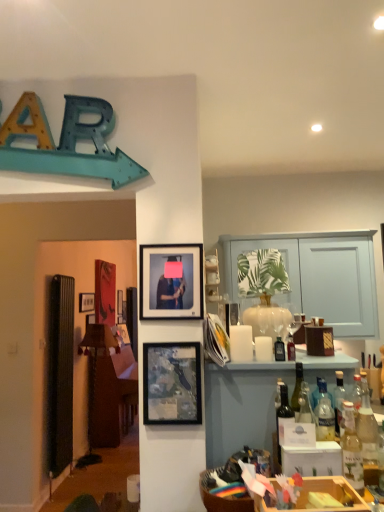
What is the approximate height of translucent glass bottle at right, the fifth bottle positioned from the right?

The height of translucent glass bottle at right, the fifth bottle positioned from the right, is 8.99 inches.

This screenshot has height=512, width=384. Describe the element at coordinates (339, 399) in the screenshot. I see `clear glass bottle at right, the fifth bottle positioned from the left` at that location.

What is the approximate width of matte glass picture frame at center, the 3th picture frame positioned from the back?

It is 1.08 inches.

Find the location of a particular element. translucent glass bottle at center-right, the 3th bottle when ordered from left to right is located at coordinates (291, 348).

Could you tell me if matte black picture frame at upper left, marked as the first picture frame in a back-to-front arrangement, is facing matte glass bottle at center, which is the second bottle from left to right?

No, matte black picture frame at upper left, marked as the first picture frame in a back-to-front arrangement, is not turned towards matte glass bottle at center, which is the second bottle from left to right.

Considering the relative sizes of matte black picture frame at upper left, the third picture frame when ordered from right to left, and matte glass bottle at center, which is counted as the fifth bottle, starting from the front, in the image provided, is matte black picture frame at upper left, the third picture frame when ordered from right to left, shorter than matte glass bottle at center, which is counted as the fifth bottle, starting from the front,?

No, matte black picture frame at upper left, the third picture frame when ordered from right to left, is not shorter than matte glass bottle at center, which is counted as the fifth bottle, starting from the front.

From a real-world perspective, is matte black picture frame at upper left, marked as the first picture frame in a back-to-front arrangement, on top of matte glass bottle at center, which appears as the fourth bottle when viewed from the right?

Correct, in the physical world, matte black picture frame at upper left, marked as the first picture frame in a back-to-front arrangement, is higher than matte glass bottle at center, which appears as the fourth bottle when viewed from the right.

Is matte black picture frame at upper left, the 3th picture frame positioned from the front, in contact with matte glass bottle at center, which is the second bottle from left to right?

No, matte black picture frame at upper left, the 3th picture frame positioned from the front, is not next to matte glass bottle at center, which is the second bottle from left to right.

Is green glass wine bottle at center wider or thinner than transparent glass vase at center?

In the image, green glass wine bottle at center appears to be more narrow than transparent glass vase at center.

Which is in front, green glass wine bottle at center or transparent glass vase at center?

green glass wine bottle at center is more forward.

At what (x,y) coordinates should I click in order to perform the action: click on wine bottle to the right of transparent glass vase at center. Please return your answer as a coordinate pair (x, y). The height and width of the screenshot is (512, 384). Looking at the image, I should click on (300, 394).

Could you tell me if green glass wine bottle at center is facing transparent glass vase at center?

No, green glass wine bottle at center is not turned towards transparent glass vase at center.

Where is `bottle that is the 3rd object located behind the wooden crate at lower right`? Image resolution: width=384 pixels, height=512 pixels. bottle that is the 3rd object located behind the wooden crate at lower right is located at coordinates (339, 399).

From a real-world perspective, is wooden crate at lower right over clear glass bottle at right, placed as the 3th bottle when sorted from front to back?

Incorrect, from a real-world perspective, wooden crate at lower right is lower than clear glass bottle at right, placed as the 3th bottle when sorted from front to back.

From the image's perspective, is wooden crate at lower right under clear glass bottle at right, the fifth bottle positioned from the left?

Correct, wooden crate at lower right appears lower than clear glass bottle at right, the fifth bottle positioned from the left, in the image.

Considering their positions, is wooden crate at lower right located in front of or behind clear glass bottle at right, placed as the 3th bottle when sorted from front to back?

Visually, wooden crate at lower right is located in front of clear glass bottle at right, placed as the 3th bottle when sorted from front to back.

Who is bigger, matte glass bottle at center, which is the second bottle from left to right, or matte black frame at upper center, the second picture frame when ordered from front to back?

With larger size is matte black frame at upper center, the second picture frame when ordered from front to back.

What's the angular difference between matte glass bottle at center, which is counted as the 1th bottle, starting from the back, and matte black frame at upper center, which is the 2th picture frame from back to front,'s facing directions?

0.258 degrees separate the facing orientations of matte glass bottle at center, which is counted as the 1th bottle, starting from the back, and matte black frame at upper center, which is the 2th picture frame from back to front.

Is matte glass bottle at center, which is the second bottle from left to right, positioned behind matte black frame at upper center, the second picture frame when ordered from front to back?

Yes, it is behind matte black frame at upper center, the second picture frame when ordered from front to back.

What's the angular difference between green glass wine bottle at center and translucent glass bottle at right, the 2th bottle in the right-to-left sequence,'s facing directions?

0.000348 degrees separate the facing orientations of green glass wine bottle at center and translucent glass bottle at right, the 2th bottle in the right-to-left sequence.

Can you confirm if green glass wine bottle at center is bigger than translucent glass bottle at right, which is the 1th bottle from front to back?

Incorrect, green glass wine bottle at center is not larger than translucent glass bottle at right, which is the 1th bottle from front to back.

Is green glass wine bottle at center oriented towards translucent glass bottle at right, which appears as the 5th bottle when viewed from the back?

No, green glass wine bottle at center does not turn towards translucent glass bottle at right, which appears as the 5th bottle when viewed from the back.

In the scene shown: Is green glass wine bottle at center directly adjacent to translucent glass bottle at right, which appears as the 5th bottle when viewed from the back?

No, green glass wine bottle at center is not touching translucent glass bottle at right, which appears as the 5th bottle when viewed from the back.

Considering their positions, is translucent glass bottle at center-right, which is the 3th bottle in right-to-left order, located in front of or behind green glass wine bottle at center?

Visually, translucent glass bottle at center-right, which is the 3th bottle in right-to-left order, is located behind green glass wine bottle at center.

From the image's perspective, is translucent glass bottle at center-right, the 3th bottle when ordered from left to right, below green glass wine bottle at center?

Incorrect, from the image's perspective, translucent glass bottle at center-right, the 3th bottle when ordered from left to right, is higher than green glass wine bottle at center.

Does translucent glass bottle at center-right, the 3th bottle when ordered from left to right, contain green glass wine bottle at center?

→ No, translucent glass bottle at center-right, the 3th bottle when ordered from left to right, does not contain green glass wine bottle at center.

Is there a large distance between translucent glass bottle at right, which is the 1th bottle from front to back, and translucent glass bottles at right?

Indeed, translucent glass bottle at right, which is the 1th bottle from front to back, is not near translucent glass bottles at right.

Is point (345, 419) farther from camera compared to point (360, 334)?

No, (345, 419) is closer to viewer.

Which object is further away from the camera, translucent glass bottle at right, which is the 1th bottle from front to back, or translucent glass bottles at right?

translucent glass bottles at right is further away from the camera.

Where is `the 1st bottle positioned above the translucent glass bottles at right (from the image's perspective)`? the 1st bottle positioned above the translucent glass bottles at right (from the image's perspective) is located at coordinates (352, 450).

From the image's perspective, starting from the matte black picture frame at upper left, marked as the first picture frame in a back-to-front arrangement, which bottle is the 1st one above? Please provide its 2D coordinates.

[(279, 349)]

The width and height of the screenshot is (384, 512). What are the coordinates of `wine bottle on the right of transparent glass vase at center` in the screenshot? It's located at pos(300,394).

Which object lies nearer to the anchor point matte glass bottle at center, which is the second bottle from left to right, wooden crate at lower right or translucent glass bottles at right?

wooden crate at lower right.

Based on their spatial positions, is matte glass bottle at center, which appears as the fourth bottle when viewed from the right, or clear glass bottle at right, the fifth bottle positioned from the left, closer to green glass wine bottle at center?

clear glass bottle at right, the fifth bottle positioned from the left, is closer to green glass wine bottle at center.

Considering their positions, is matte glass bottle at center, which is the second bottle from left to right, positioned closer to clear glass bottle at right, placed as the 3th bottle when sorted from front to back, than translucent glass bottle at right, the 2th bottle from the front?

translucent glass bottle at right, the 2th bottle from the front.

From the image, which object appears to be nearer to matte black frame at upper center, the second picture frame when ordered from front to back, translucent glass bottle at right, which appears as the 4th bottle when viewed from the back, or green glass wine bottle at center?

translucent glass bottle at right, which appears as the 4th bottle when viewed from the back.

Based on their spatial positions, is matte glass picture frame at center, the 1th picture frame viewed from the front, or translucent glass bottles at right closer to matte black picture frame at upper left, the third picture frame when ordered from right to left?

translucent glass bottles at right lies closer to matte black picture frame at upper left, the third picture frame when ordered from right to left, than the other object.

In the scene shown: Which object lies further to the anchor point matte glass picture frame at center, which is the third picture frame in left-to-right order, wooden crate at lower right or transparent glass vase at center?

transparent glass vase at center.

When comparing their distances from matte glass picture frame at center, which appears as the 1th picture frame when viewed from the right, does green glass wine bottle at center or translucent glass bottle at right, which is the 1th bottle from front to back, seem closer?

green glass wine bottle at center is closer to matte glass picture frame at center, which appears as the 1th picture frame when viewed from the right.

Based on their spatial positions, is matte black picture frame at upper left, marked as the first picture frame in a back-to-front arrangement, or translucent glass bottles at right further from matte glass picture frame at center, which appears as the 1th picture frame when viewed from the right?

matte black picture frame at upper left, marked as the first picture frame in a back-to-front arrangement, is positioned further to the anchor matte glass picture frame at center, which appears as the 1th picture frame when viewed from the right.

Locate an element on the screen. entertainment center between matte glass picture frame at center, the 3th picture frame positioned from the back, and clear glass bottle at right, the 3th bottle viewed from the back is located at coordinates [x=318, y=276].

What are the coordinates of `wine bottle positioned between translucent glass bottle at right, placed as the first bottle when sorted from left to right, and matte glass bottle at center, which is counted as the 1th bottle, starting from the back, from near to far` in the screenshot? It's located at (300, 394).

What are the coordinates of `entertainment center located between matte glass picture frame at center, the 1th picture frame viewed from the front, and matte black picture frame at upper left, which is the first picture frame in left-to-right order, in the depth direction` in the screenshot? It's located at (318, 276).

The height and width of the screenshot is (512, 384). In order to click on wine bottle located between matte black frame at upper center, the second picture frame when ordered from front to back, and translucent glass bottle at right, the 2th bottle in the right-to-left sequence, in the left-right direction in this screenshot , I will do `click(300, 394)`.